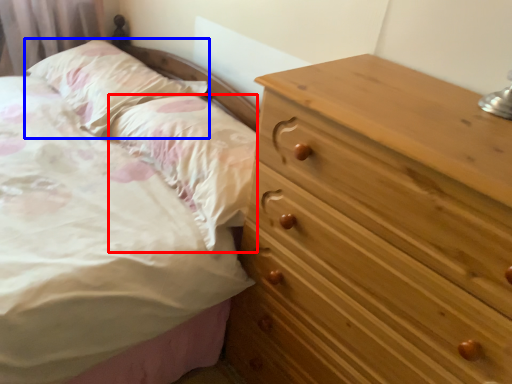
Question: Among these objects, which one is farthest to the camera, pillow (highlighted by a red box) or pillow (highlighted by a blue box)?

Choices:
 (A) pillow
 (B) pillow

Answer: (B)